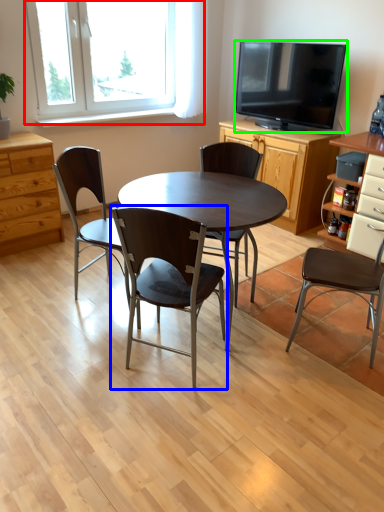
Question: Considering the real-world distances, which object is closest to window (highlighted by a red box)? chair (highlighted by a blue box) or television (highlighted by a green box).

Choices:
 (A) chair
 (B) television

Answer: (B)